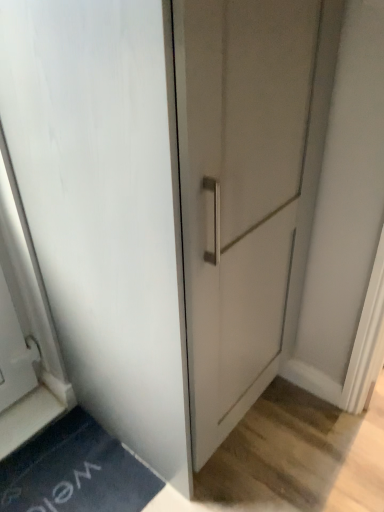
Locate an element on the screen. The image size is (384, 512). free space above dark blue rubber bath mat at lower left (from a real-world perspective) is located at coordinates (77, 470).